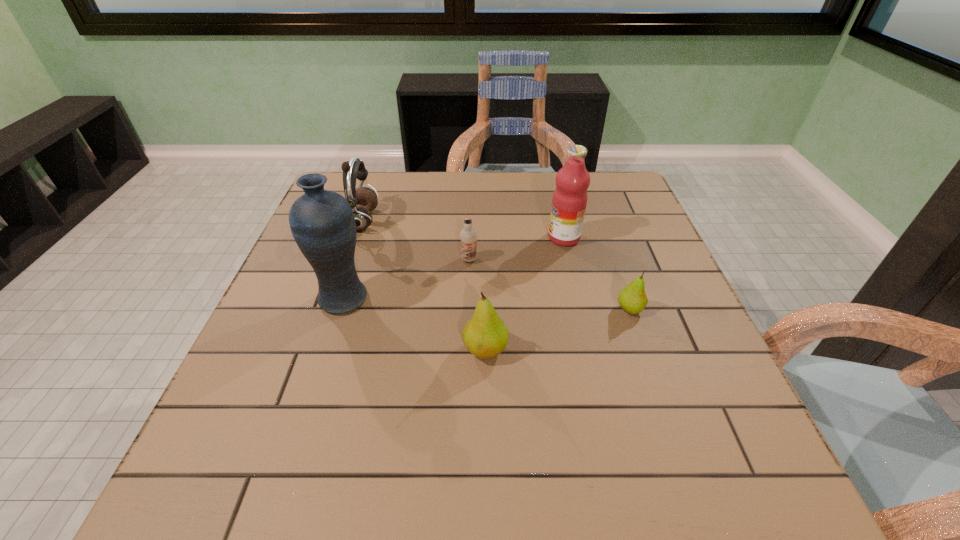
Where is `vacant space that satisfies the following two spatial constraints: 1. on the ear pads of the third shortest object; 2. on the right side of the third tallest object`? The image size is (960, 540). vacant space that satisfies the following two spatial constraints: 1. on the ear pads of the third shortest object; 2. on the right side of the third tallest object is located at coordinates (319, 349).

This screenshot has height=540, width=960. I want to click on blank space that satisfies the following two spatial constraints: 1. on the ear pads of the earphone; 2. on the back side of the tallest object, so click(x=337, y=298).